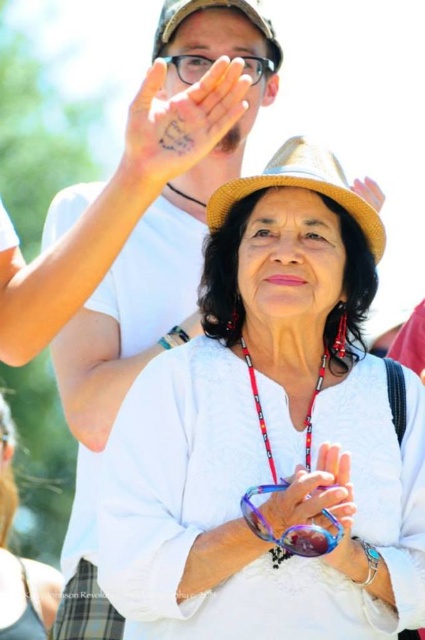
Question: Which object is closer to the camera taking this photo?

Choices:
 (A) translucent plastic goggles at center
 (B) white matte shirt at center
 (C) matte straw hat at center
 (D) transparent plastic goggles at upper center

Answer: (A)

Question: Among these objects, which one is farthest from the camera?

Choices:
 (A) translucent plastic goggles at center
 (B) matte straw hat at center
 (C) smooth skin palm at upper center
 (D) white matte shirt at center

Answer: (D)

Question: Can you confirm if white woven hat at center is positioned to the right of matte brown hat at upper center?

Choices:
 (A) yes
 (B) no

Answer: (B)

Question: Which of the following is the closest to the observer?

Choices:
 (A) 204,125
 (B) 365,195
 (C) 215,49
 (D) 5,516

Answer: (A)

Question: Does smooth skin palm at upper center appear on the left side of matte brown hat at upper center?

Choices:
 (A) yes
 (B) no

Answer: (A)

Question: Does white matte shirt at center come in front of transparent plastic goggles at upper center?

Choices:
 (A) yes
 (B) no

Answer: (B)